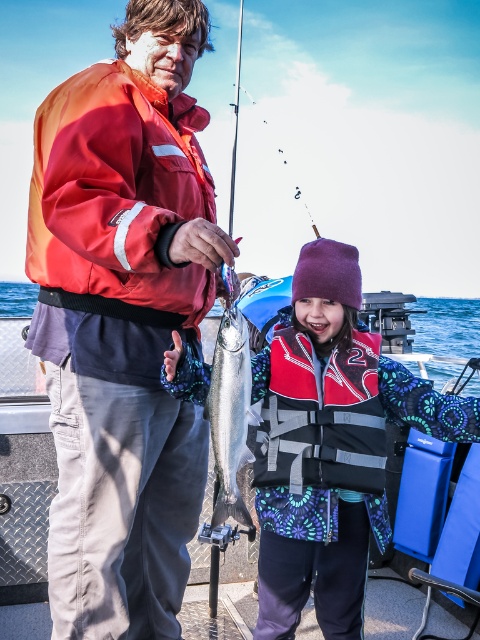
Where is `metallic blue boat at center`? metallic blue boat at center is located at coordinates (x=25, y=513).

Is point (468, 355) positioned behind point (239, 403)?

Yes, point (468, 355) is behind point (239, 403).

Image resolution: width=480 pixels, height=640 pixels. Find the location of `metallic blue boat at center`. metallic blue boat at center is located at coordinates (25, 513).

Is the position of metallic blue boat at center more distant than that of red fabric life jacket at center?

Yes, metallic blue boat at center is behind red fabric life jacket at center.

Between metallic blue boat at center and red fabric life jacket at center, which one appears on the left side from the viewer's perspective?

red fabric life jacket at center is more to the left.

The image size is (480, 640). Identify the location of metallic blue boat at center. (25, 513).

Is point (105, 364) closer to viewer compared to point (217, 400)?

Yes, it is.

Where is `matte red jacket at center`? The image size is (480, 640). matte red jacket at center is located at coordinates (122, 321).